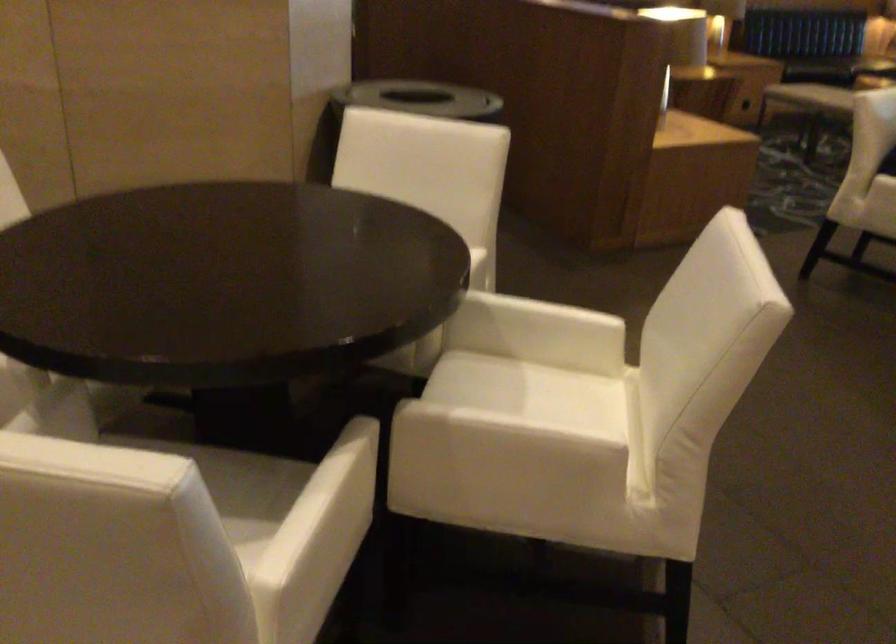
This screenshot has width=896, height=644. What do you see at coordinates (236, 483) in the screenshot?
I see `the chair sitting surface` at bounding box center [236, 483].